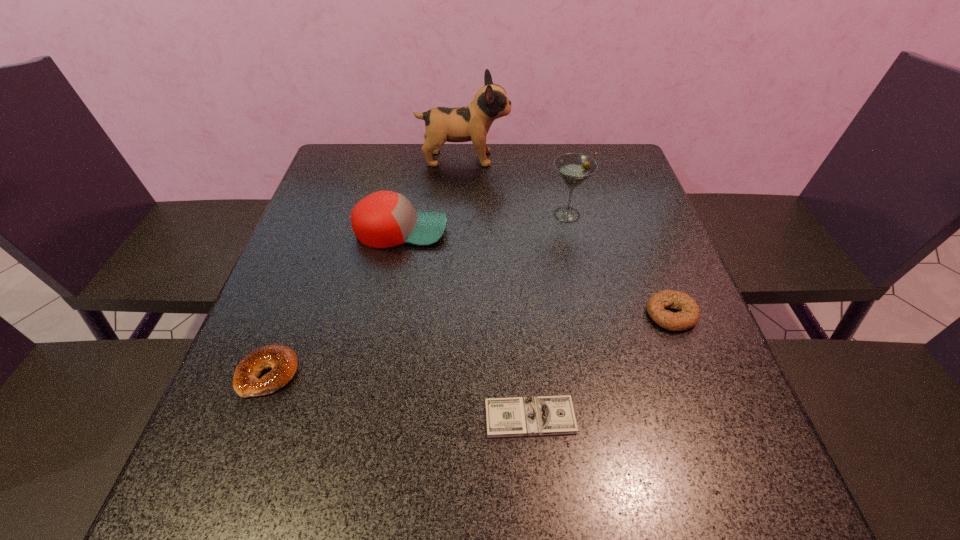
This screenshot has width=960, height=540. I want to click on the farthest object, so click(x=468, y=123).

At what (x,y) coordinates should I click in order to perform the action: click on the tallest object. Please return your answer as a coordinate pair (x, y). This screenshot has width=960, height=540. Looking at the image, I should click on (468, 123).

I want to click on the fifth shortest object, so click(574, 168).

Identify the location of martini. The image size is (960, 540). (574, 168).

Find the location of `the fourth shortest object`. the fourth shortest object is located at coordinates (383, 219).

I want to click on the leftmost object, so [282, 360].

You are a GUI agent. You are given a task and a screenshot of the screen. Output one action in this format:
    pyautogui.click(x=<x>, y=<y>)
    Task: Click on the nearer bagel
    
    Given the screenshot: What is the action you would take?
    pyautogui.click(x=282, y=360)

Where is `the right bagel`? The height and width of the screenshot is (540, 960). the right bagel is located at coordinates 689,316.

Where is `the rightmost object`? the rightmost object is located at coordinates (689, 316).

Find the location of a particular element. dollar is located at coordinates (545, 415).